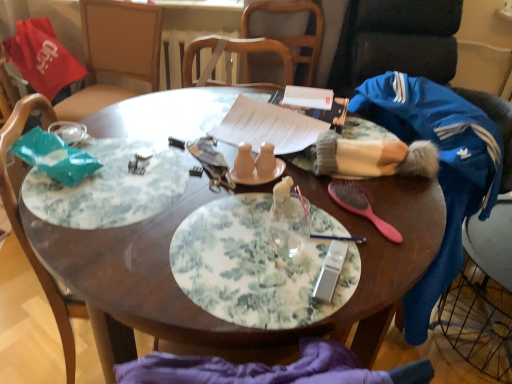
Where is `vacant area that is in front of matte ceramic salt and pepper shakers at center, arranged as the third tableware when viewed from the right`? Image resolution: width=512 pixels, height=384 pixels. vacant area that is in front of matte ceramic salt and pepper shakers at center, arranged as the third tableware when viewed from the right is located at coordinates (264, 221).